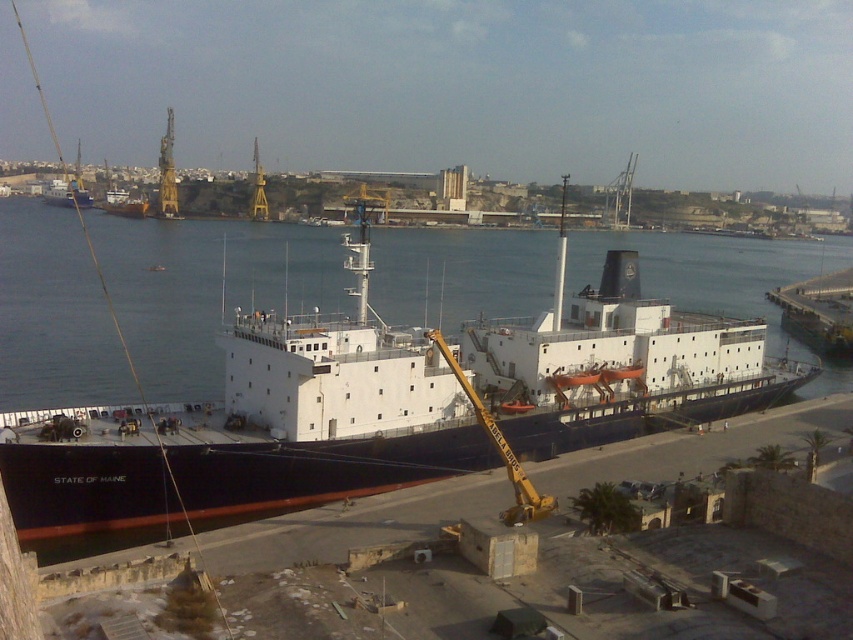
Can you confirm if black matte ship at center is bigger than matte black ship at upper left?

Indeed, black matte ship at center has a larger size compared to matte black ship at upper left.

Does point (137, 433) come farther from viewer compared to point (90, 204)?

No, (137, 433) is closer to viewer.

Is point (103, 416) less distant than point (61, 202)?

Yes, it is in front of point (61, 202).

You are a GUI agent. You are given a task and a screenshot of the screen. Output one action in this format:
    pyautogui.click(x=<x>, y=<y>)
    Task: Click on the black matte ship at center
    This screenshot has height=640, width=853.
    Given the screenshot: What is the action you would take?
    pyautogui.click(x=383, y=408)